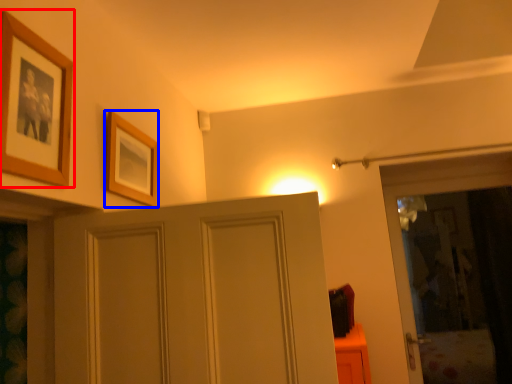
Question: Which object appears farthest to the camera in this image, picture frame (highlighted by a red box) or picture frame (highlighted by a blue box)?

Choices:
 (A) picture frame
 (B) picture frame

Answer: (B)